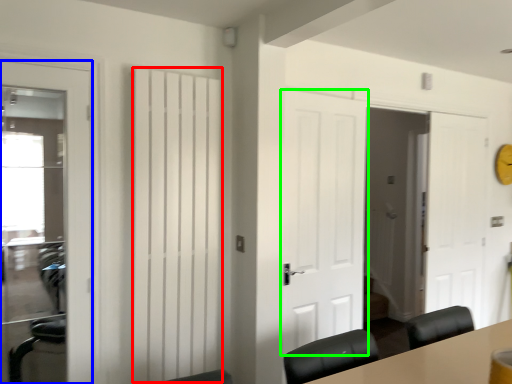
Question: Based on their relative distances, which object is nearer to curtain (highlighted by a red box)? Choose from door (highlighted by a blue box) and door (highlighted by a green box).

Choices:
 (A) door
 (B) door

Answer: (A)